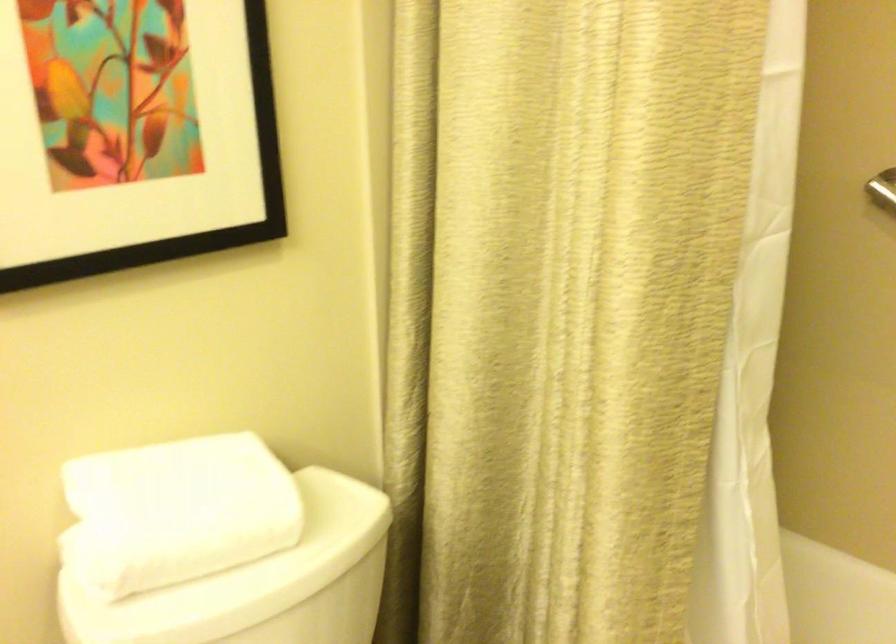
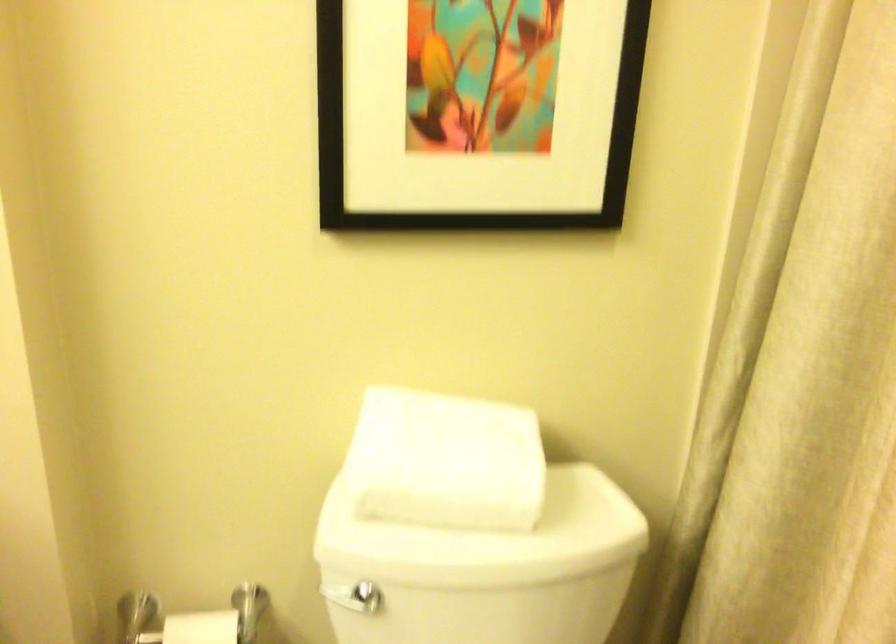
Find the pixel in the second image that matches (197,507) in the first image.

(445, 460)